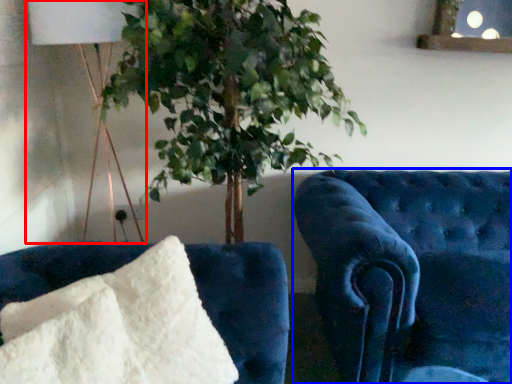
Question: Which of the following is the farthest to the observer, table lamp (highlighted by a red box) or furniture (highlighted by a blue box)?

Choices:
 (A) table lamp
 (B) furniture

Answer: (A)